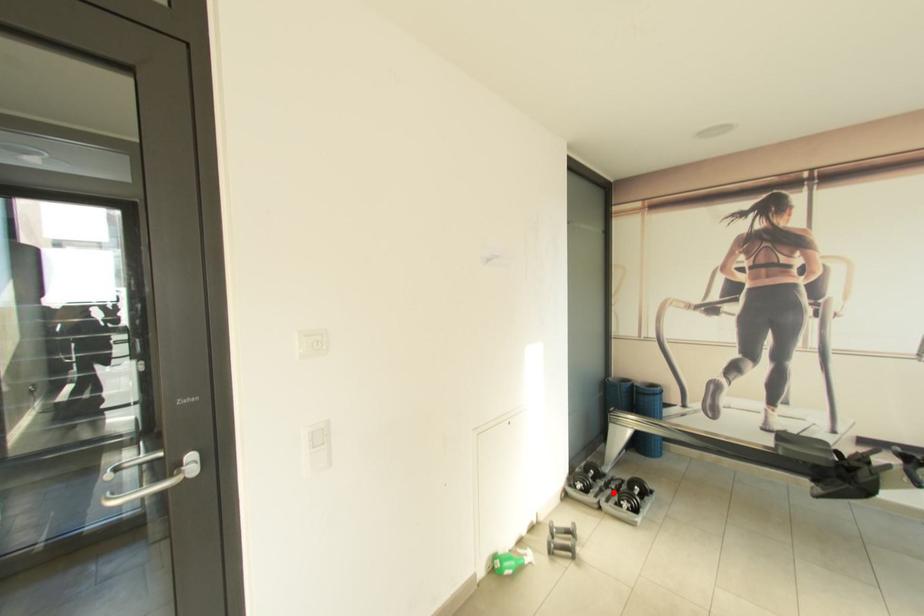
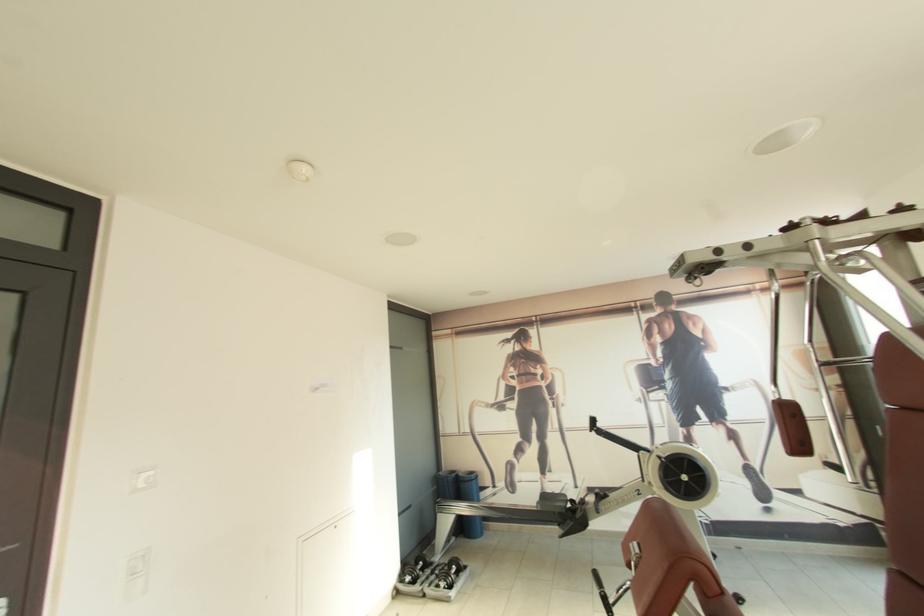
Locate, in the second image, the point that corresponds to the highlighted location in the first image.

(436, 578)